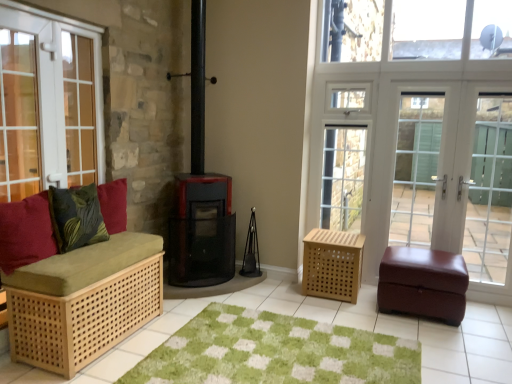
Locate an element on the screen. free location to the left of light brown woven basket at center-right, which ranks as the 2th furniture in left-to-right order is located at coordinates (285, 295).